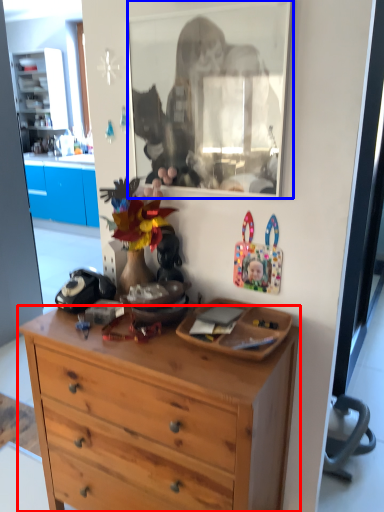
Question: Which object is further to the camera taking this photo, desk (highlighted by a red box) or mirror (highlighted by a blue box)?

Choices:
 (A) desk
 (B) mirror

Answer: (B)